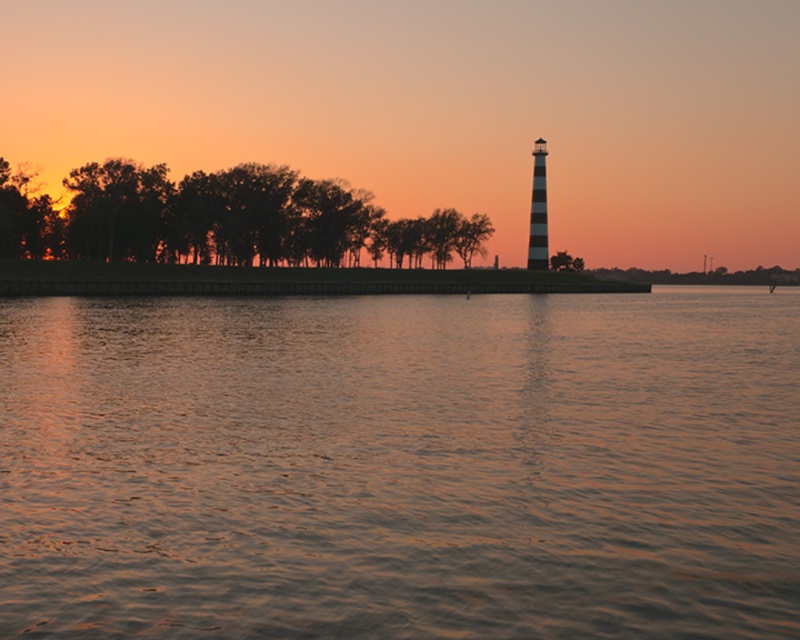
You are standing at the edge of the island where the lighthouse is located. You see the smooth water at center and the silhouette wood trees at left. Which object is closer to you?

The smooth water at center is closer to the viewer than the silhouette wood trees at left.

You are standing at the lighthouse in the sunset scene and want to take a photo. There are two points of interest marked as point 1 at coordinates point (333, 458) and point 2 at point (306, 196). Which point is closer to your current position at the lighthouse?

Point (333, 458) is closer to the camera than point (306, 196), so the point closer to your position at the lighthouse is point (333, 458).

You are standing at the edge of the island where the lighthouse is located. You want to walk towards the smooth water at center. Which direction should you move relative to the silhouette wood trees at left?

You should move to the right of the silhouette wood trees at left because the smooth water at center is located to the right of them.